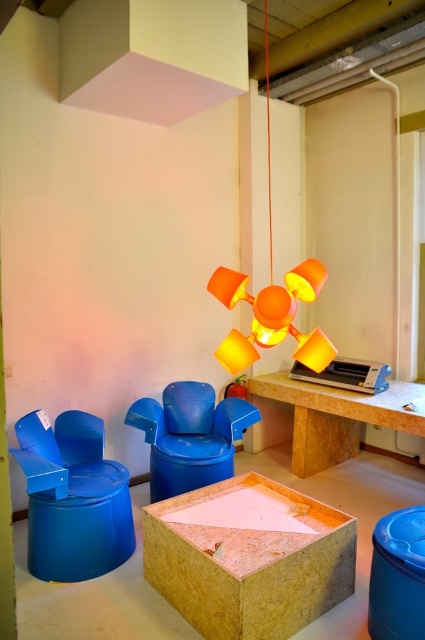
Is wooden table at center above orange matte lampshade at center?

Actually, wooden table at center is below orange matte lampshade at center.

Is wooden table at center further to the viewer compared to orange matte lampshade at center?

Yes.

Which is behind, point (351, 452) or point (305, 262)?

Positioned behind is point (351, 452).

I want to click on wooden table at center, so click(336, 417).

Does blue plastic chair at lower left appear over wooden table at center?

No, blue plastic chair at lower left is not above wooden table at center.

Describe the element at coordinates (73, 497) in the screenshot. This screenshot has height=640, width=425. I see `blue plastic chair at lower left` at that location.

I want to click on blue plastic chair at lower left, so click(73, 497).

Does orange matte lampshade at center have a smaller size compared to blue plastic lid at lower right?

Actually, orange matte lampshade at center might be larger than blue plastic lid at lower right.

Does orange matte lampshade at center lie in front of blue plastic lid at lower right?

No, orange matte lampshade at center is further to the viewer.

Is point (325, 348) positioned after point (410, 531)?

That is True.

I want to click on orange matte lampshade at center, so click(272, 296).